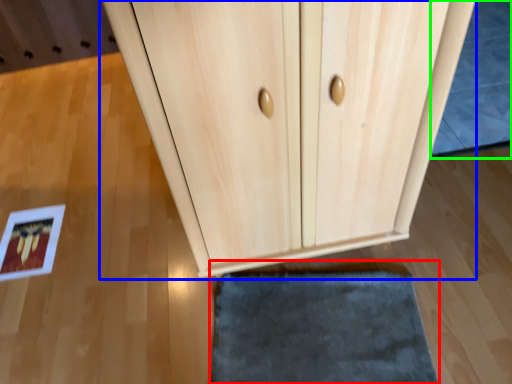
Question: Considering the real-world distances, which object is closest to door (highlighted by a red box)? cupboard (highlighted by a blue box) or bath mat (highlighted by a green box).

Choices:
 (A) cupboard
 (B) bath mat

Answer: (A)